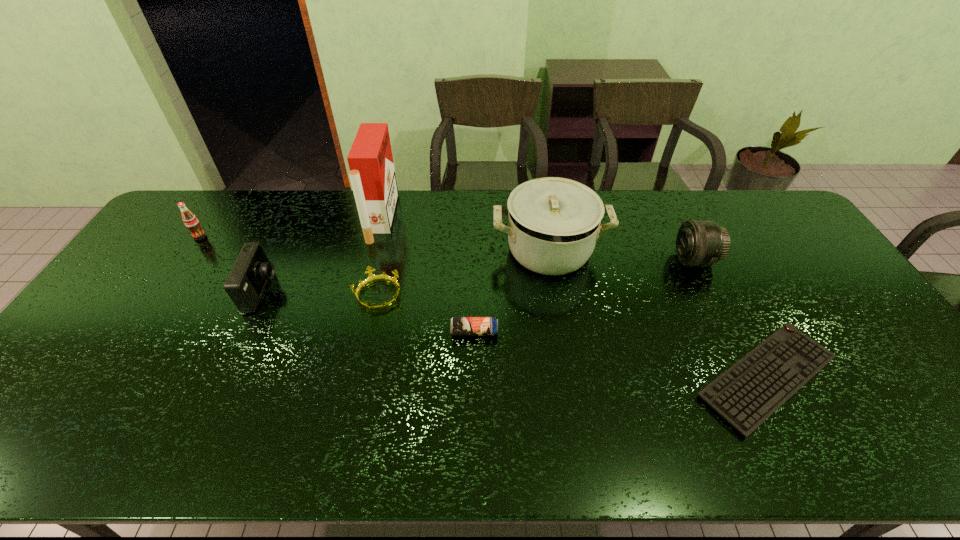
The width and height of the screenshot is (960, 540). Find the location of `cigarette case`. cigarette case is located at coordinates (372, 174).

Locate an element on the screen. the seventh shortest object is located at coordinates (553, 223).

Locate an element on the screen. This screenshot has width=960, height=540. telephoto lens is located at coordinates (700, 243).

This screenshot has height=540, width=960. I want to click on the leftmost object, so click(191, 222).

Locate an element on the screen. Image resolution: width=960 pixels, height=540 pixels. the second object from left to right is located at coordinates (248, 278).

Locate an element on the screen. This screenshot has width=960, height=540. crown is located at coordinates (372, 278).

Image resolution: width=960 pixels, height=540 pixels. I want to click on beer can, so click(x=460, y=326).

This screenshot has height=540, width=960. Identify the location of the shortest object. (750, 391).

Where is `vacant region located 0.170m on the front-facing side of the cigarette case`? vacant region located 0.170m on the front-facing side of the cigarette case is located at coordinates (443, 219).

Locate an element on the screen. The width and height of the screenshot is (960, 540). free space located on the back of the saucepan is located at coordinates (541, 200).